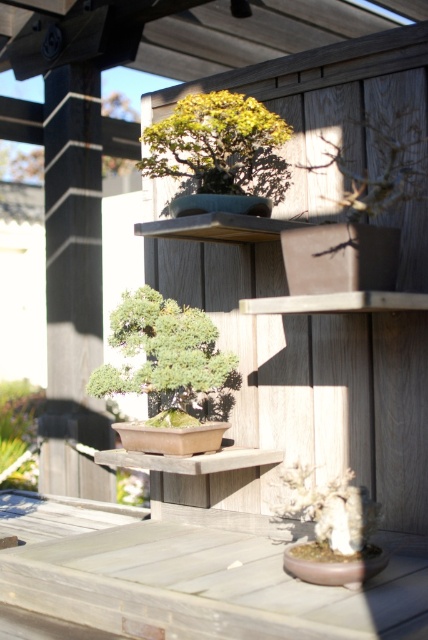
Is point (335, 502) in front of point (27, 460)?

Yes, it is.

Does white textured rock at center appear on the left side of green matte bonsai at lower left?

No, white textured rock at center is not to the left of green matte bonsai at lower left.

In order to click on white textured rock at center in this screenshot , I will do `click(330, 508)`.

I want to click on white textured rock at center, so click(x=330, y=508).

Is green matte bonsai tree at upper center above white textured rock at center?

Yes.

Does green matte bonsai tree at upper center appear under white textured rock at center?

No.

Identify the location of green matte bonsai tree at upper center. (219, 147).

This screenshot has height=640, width=428. I want to click on green matte bonsai tree at upper center, so click(x=219, y=147).

Who is more distant from viewer, (x=231, y=180) or (x=112, y=328)?

The point (x=112, y=328) is more distant.

Does green matte bonsai tree at upper center have a lesser height compared to green matte bonsai tree at center?

No, green matte bonsai tree at upper center is not shorter than green matte bonsai tree at center.

Is point (222, 154) positioned after point (192, 349)?

No, it is not.

Identify the location of green matte bonsai tree at upper center. The width and height of the screenshot is (428, 640). (219, 147).